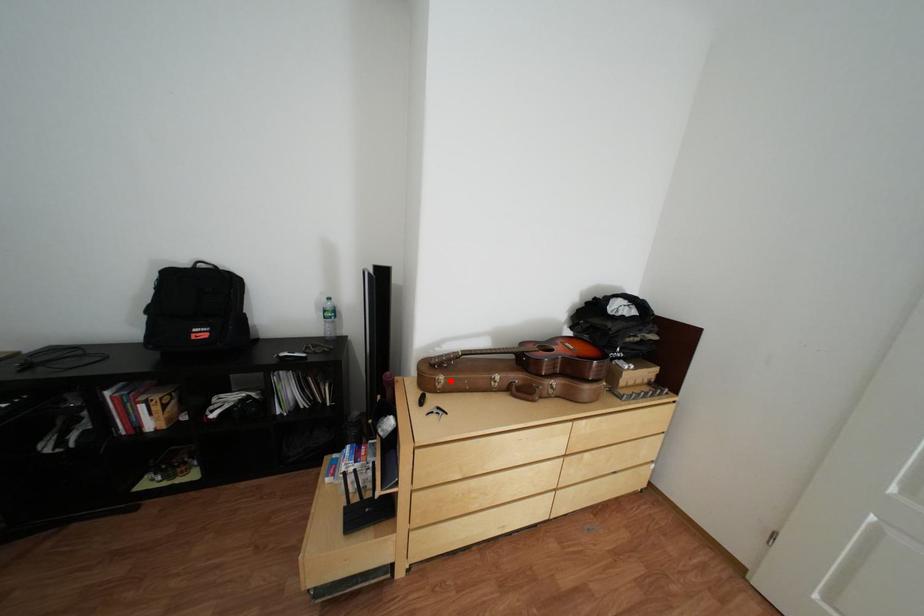
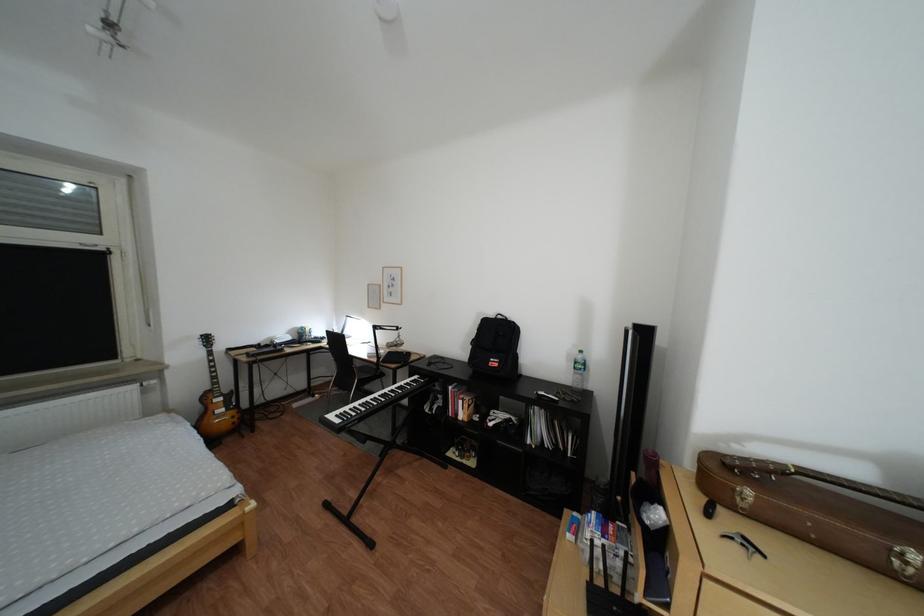
The point at the highlighted location is marked in the first image. Where is the corresponding point in the second image?

(749, 491)